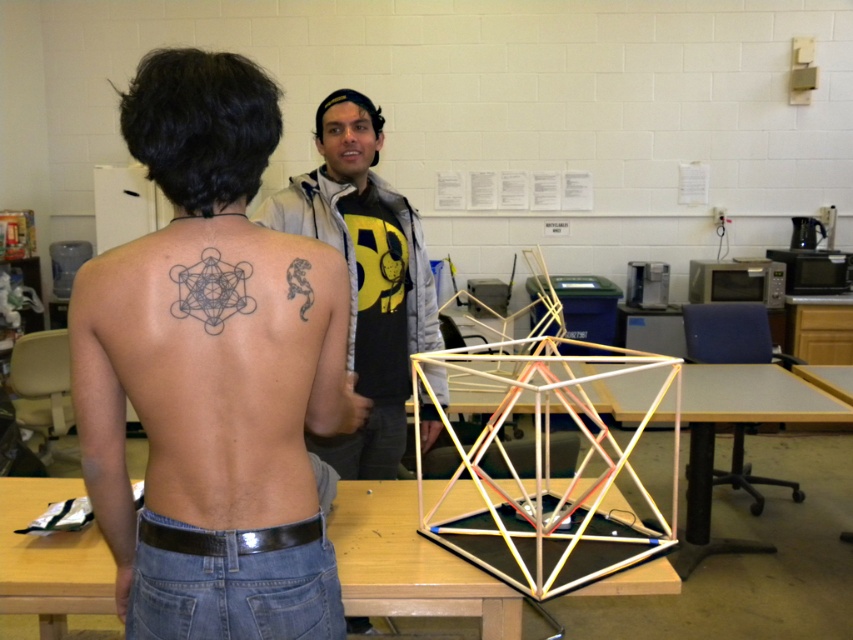
Between white plastic table at center and black ink lizard at upper back, which one is positioned higher?

black ink lizard at upper back

The width and height of the screenshot is (853, 640). What do you see at coordinates (730, 422) in the screenshot?
I see `white plastic table at center` at bounding box center [730, 422].

Find the location of a particular element. The image size is (853, 640). white plastic table at center is located at coordinates (730, 422).

Is point (212, 620) more distant than point (357, 369)?

That is False.

Does black skin tattoo at upper center have a greater height compared to matte gray hoodie at center?

Incorrect, black skin tattoo at upper center's height is not larger of matte gray hoodie at center's.

Image resolution: width=853 pixels, height=640 pixels. Find the location of `black skin tattoo at upper center`. black skin tattoo at upper center is located at coordinates (210, 378).

Describe the element at coordinates (207, 372) in the screenshot. Image resolution: width=853 pixels, height=640 pixels. I see `black ink tattoo at upper center` at that location.

Is point (120, 472) closer to camera compared to point (296, 269)?

No.

Where is `black ink tattoo at upper center`? Image resolution: width=853 pixels, height=640 pixels. black ink tattoo at upper center is located at coordinates (207, 372).